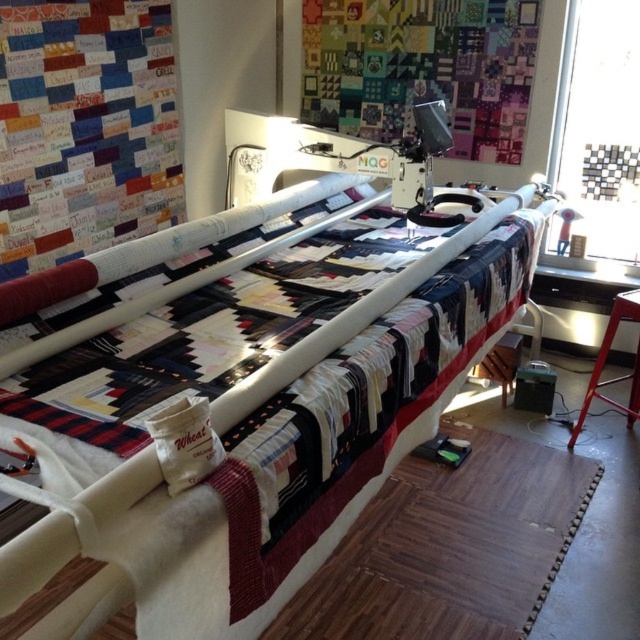
You are a quilter working on the MQG quilting machine. You need to stitch a design starting at point (x=268, y=426). Is this point located on the quilted bed?

Yes, the point (x=268, y=426) is on the white quilted bed at center, so it is located on the quilted bed.

You are a visitor in a quilting studio and see the white quilted bed at center and the metallic red stool at lower right. Which object is located to the left of the other?

The white quilted bed at center is positioned on the left side of metallic red stool at lower right.